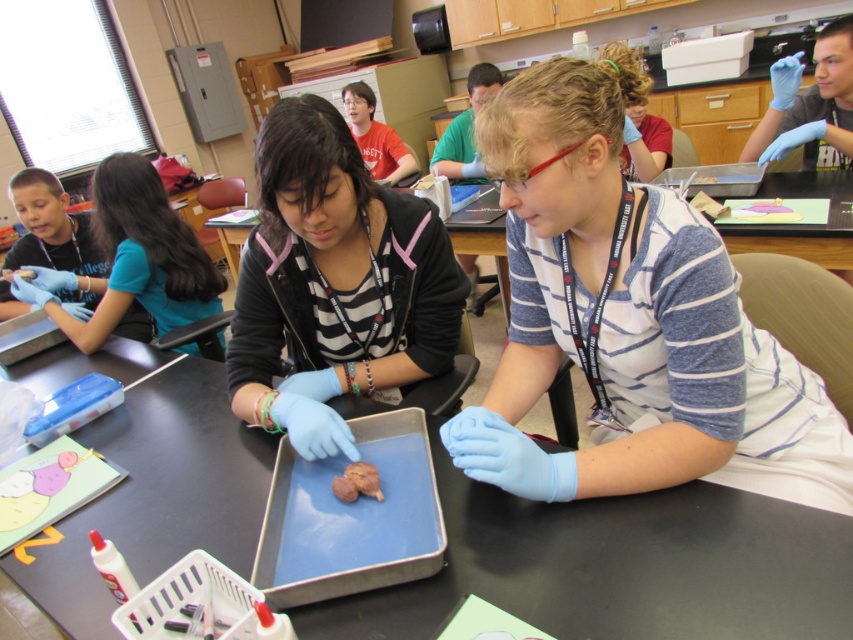
Does blue rubber glove at center have a greater width compared to blue rubber glove at left?

No.

Is point (689, 369) positioned in front of point (181, 301)?

Yes, it is in front of point (181, 301).

Image resolution: width=853 pixels, height=640 pixels. What do you see at coordinates (630, 323) in the screenshot?
I see `blue rubber glove at center` at bounding box center [630, 323].

Image resolution: width=853 pixels, height=640 pixels. Identify the location of blue rubber glove at center. (630, 323).

Does point (392, 307) lie behind point (177, 269)?

No, (392, 307) is in front of (177, 269).

Is matte black shirt at center below blue rubber glove at left?

Correct, matte black shirt at center is located below blue rubber glove at left.

Does point (416, 340) lie behind point (33, 276)?

No, it is not.

Locate an element on the screen. matte black shirt at center is located at coordinates (334, 284).

Does blue rubber glove at center have a larger size compared to matte black shirt at center?

Yes.

Between point (486, 481) and point (273, 112), which one is positioned in front?

Point (486, 481)

You are a GUI agent. You are given a task and a screenshot of the screen. Output one action in this format:
    pyautogui.click(x=<x>, y=<y>)
    Task: Click on the blue rubber glove at center
    Image resolution: width=853 pixels, height=640 pixels.
    Given the screenshot: What is the action you would take?
    pyautogui.click(x=630, y=323)